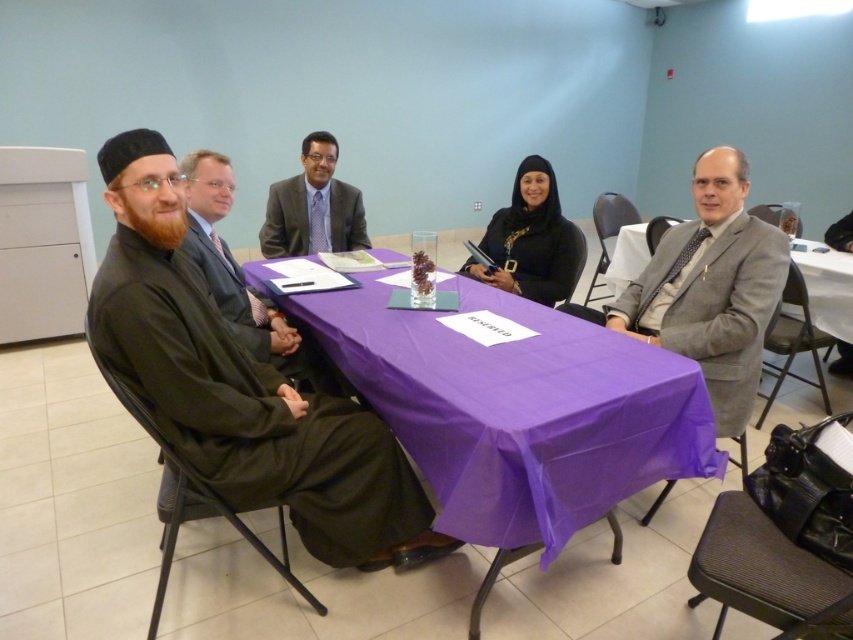
You are organizing a photo shoot and need to arrange two outfits from the image for a catalog. The gray wool suit at right and the matte black robe at center are the chosen items. Based on their sizes, which outfit would require a wider display stand?

The matte black robe at center requires a wider display stand because it has a greater width than the gray wool suit at right.

You are organizing a photo shoot and need to position two key outfits in the scene for a catalog. The gray wool suit at right and the matte black robe at center are both featured items. Based on their positions, which outfit is placed lower on the table?

The gray wool suit at right is located below the matte black robe at center, so the gray wool suit at right is placed lower on the table.